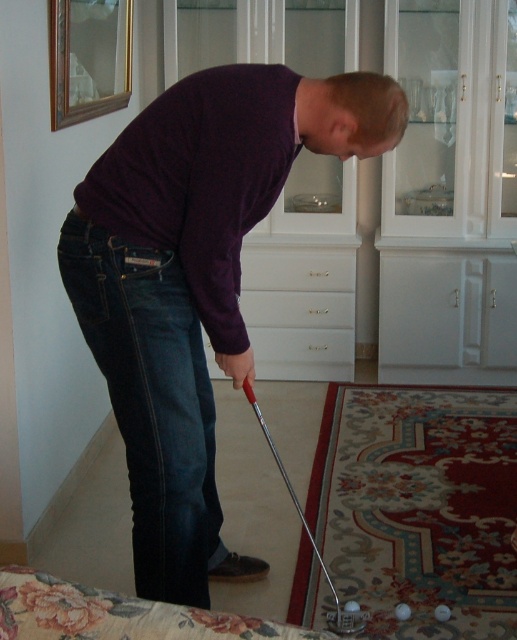
Question: Considering the relative positions of purple matte sweater at center and dark blue denim jeans at lower left in the image provided, where is purple matte sweater at center located with respect to dark blue denim jeans at lower left?

Choices:
 (A) left
 (B) right

Answer: (B)

Question: Among these points, which one is nearest to the camera?

Choices:
 (A) (215, 561)
 (B) (253, 275)

Answer: (A)

Question: Which point is closer to the camera?

Choices:
 (A) (170, 124)
 (B) (139, 484)
 (C) (285, 252)

Answer: (A)

Question: Among these objects, which one is farthest from the camera?

Choices:
 (A) white glossy drawer at center
 (B) dark blue denim jeans at lower left

Answer: (A)

Question: Is dark blue denim jeans at lower left above white glossy drawer at center?

Choices:
 (A) no
 (B) yes

Answer: (A)

Question: Can you confirm if purple matte sweater at center is bigger than dark blue denim jeans at lower left?

Choices:
 (A) yes
 (B) no

Answer: (A)